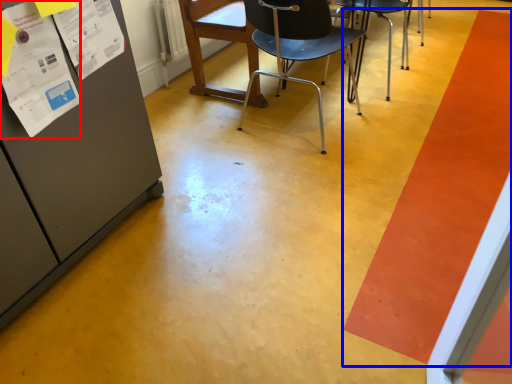
Question: Which point is further to the camera, poster (highlighted by a red box) or strip (highlighted by a blue box)?

Choices:
 (A) poster
 (B) strip

Answer: (B)